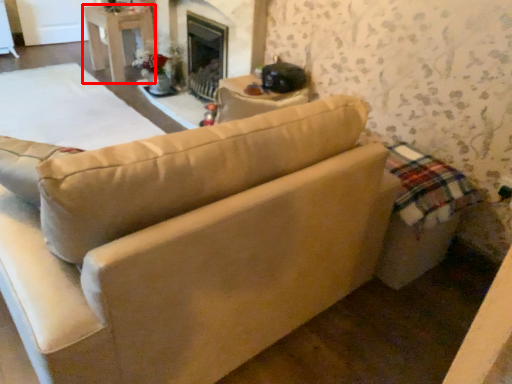
Question: From the image, what is the correct spatial relationship of table (annotated by the red box) in relation to studio couch?

Choices:
 (A) left
 (B) right

Answer: (A)